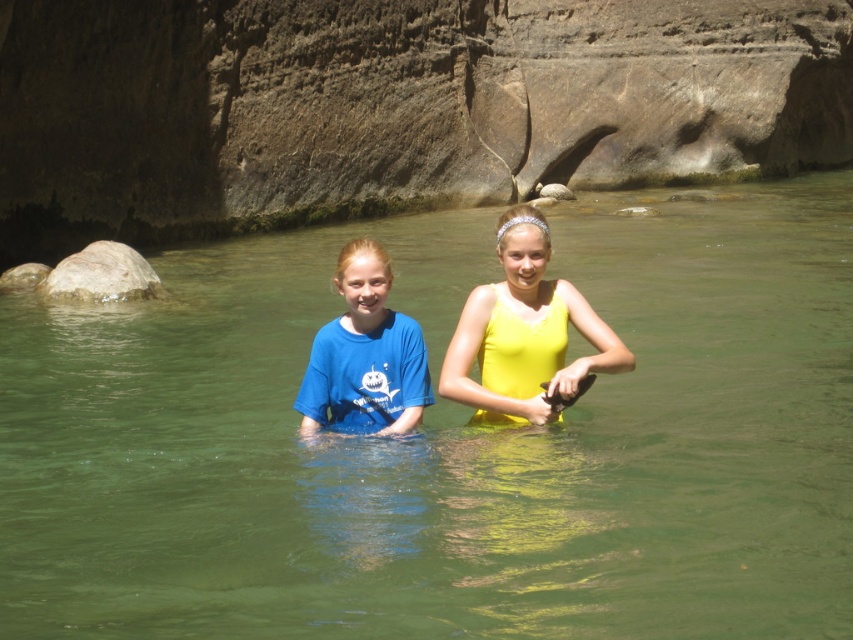
Question: Which point is closer to the camera?

Choices:
 (A) matte blue t-shirt at center
 (B) smooth gray rock at left
 (C) yellow matte tank top at center

Answer: (C)

Question: Estimate the real-world distances between objects in this image. Which object is farther from the yellow matte tank top at center?

Choices:
 (A) smooth gray rock at left
 (B) matte blue t-shirt at center

Answer: (A)

Question: In this image, where is green translucent water at center located relative to yellow matte tank top at center?

Choices:
 (A) below
 (B) above

Answer: (A)

Question: Which of the following is the farthest from the observer?

Choices:
 (A) smooth gray rock at left
 (B) green translucent water at center
 (C) yellow matte tank top at center
 (D) matte blue t-shirt at center

Answer: (A)

Question: Does matte blue t-shirt at center appear on the left side of smooth gray rock at left?

Choices:
 (A) yes
 (B) no

Answer: (B)

Question: Is yellow matte tank top at center to the left of smooth gray rock at left from the viewer's perspective?

Choices:
 (A) no
 (B) yes

Answer: (A)